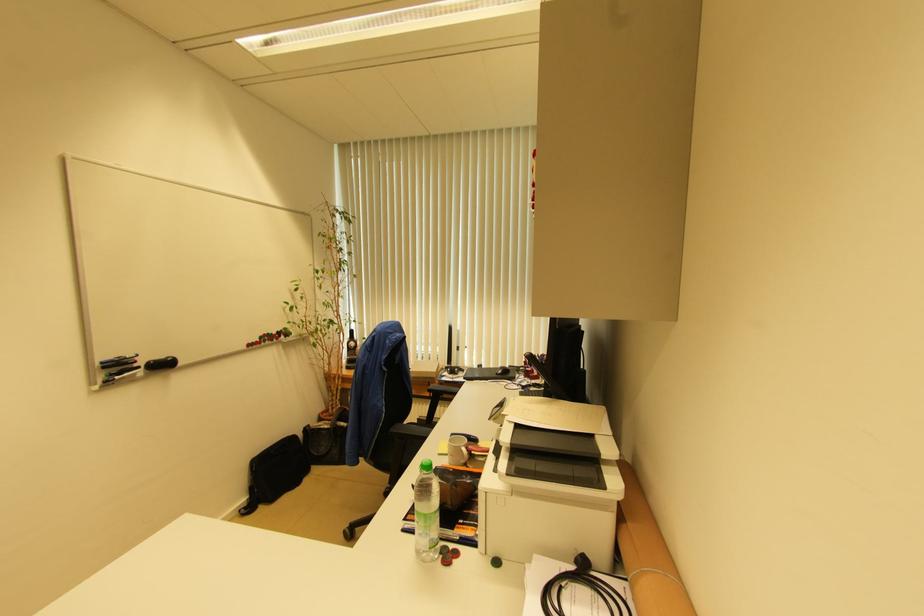
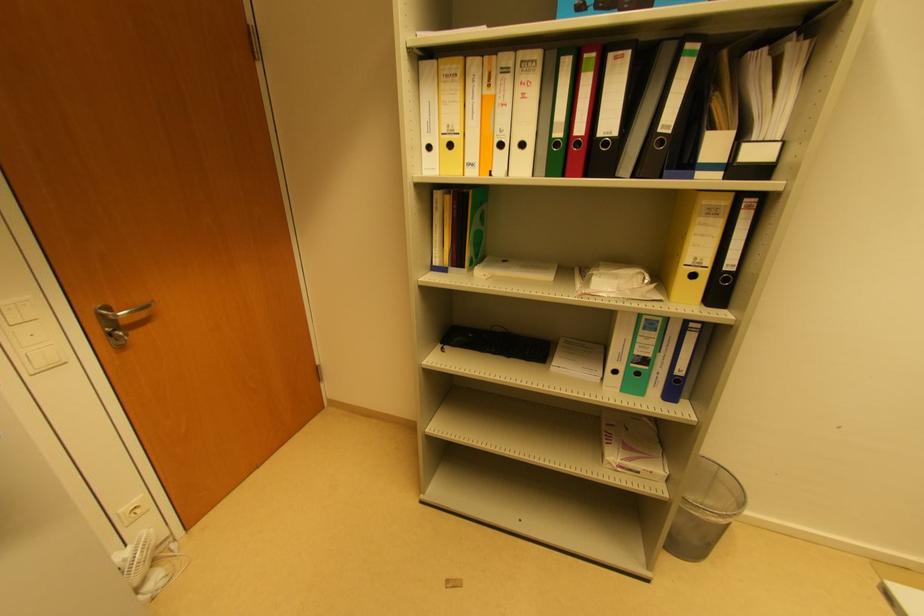
First-person continuous shooting, in which direction is the camera rotating?

The camera rotated toward left-down.